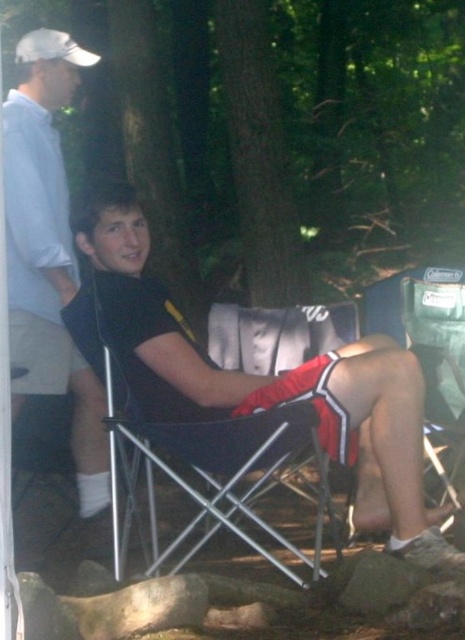
From the picture: Does black fabric shorts at center appear over black matte shirt at upper left?

No, black fabric shorts at center is not above black matte shirt at upper left.

Is black fabric shorts at center below black matte shirt at upper left?

Indeed, black fabric shorts at center is positioned under black matte shirt at upper left.

Between point (123, 186) and point (50, 321), which one is positioned in front?

Point (123, 186)

Identify the location of black fabric shorts at center. This screenshot has width=465, height=640. (267, 380).

Measure the distance between point (376, 385) and camera.

Point (376, 385) is 6.90 feet away from camera.

Between point (369, 404) and point (225, 497), which one is positioned behind?

The point (225, 497) is behind.

Is point (117, 282) positioned before point (247, 426)?

No.

Locate an element on the screen. The width and height of the screenshot is (465, 640). black fabric shorts at center is located at coordinates (267, 380).

Is black matte shirt at upper left further to the viewer compared to black fabric chair at center?

Yes, black matte shirt at upper left is behind black fabric chair at center.

Find the location of `black matte shirt at upper left`. black matte shirt at upper left is located at coordinates (47, 252).